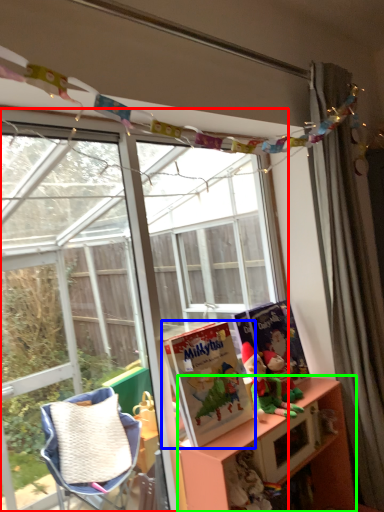
Question: Estimate the real-world distances between objects in this image. Which object is closer to window (highlighted by a red box), book (highlighted by a blue box) or shelf (highlighted by a green box)?

Choices:
 (A) book
 (B) shelf

Answer: (A)